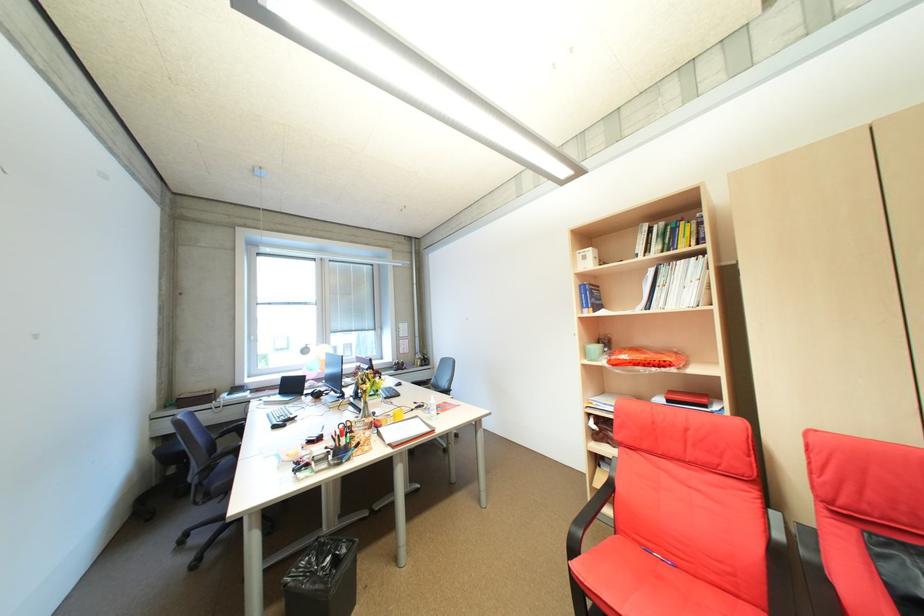
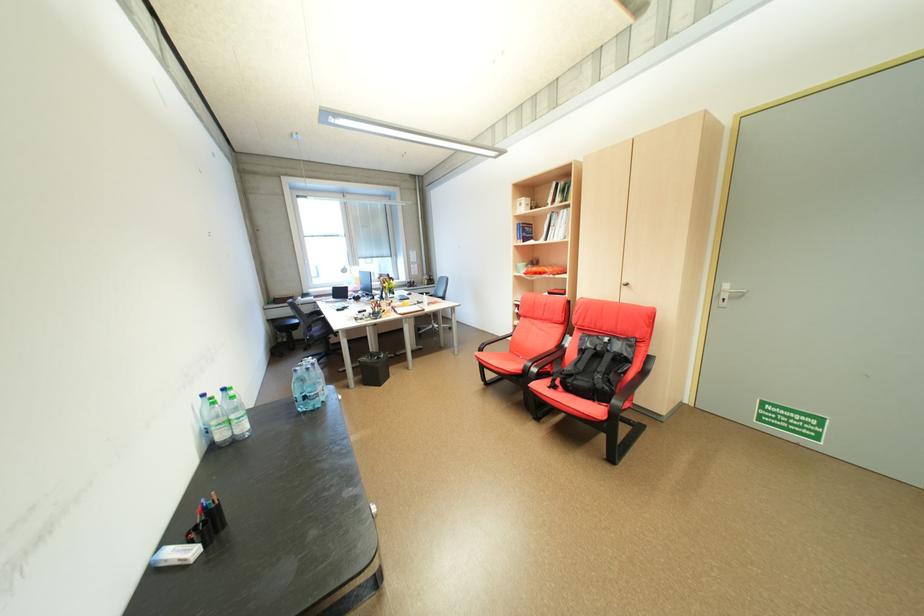
Which direction would the cameraman need to move to produce the second image?

The movement direction of the cameraman is right, backward.